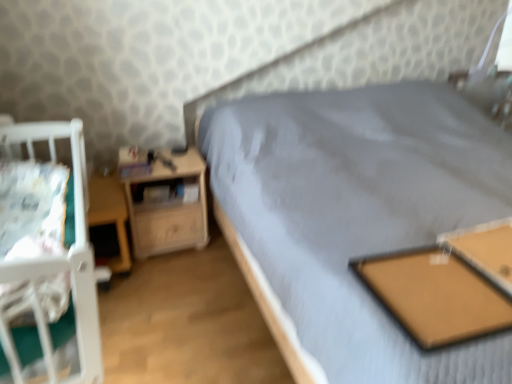
What is the approximate height of white fabric sheet at left?

white fabric sheet at left is 6.97 inches in height.

Identify the location of wooden table at lower left, which is counted as the second table, starting from the right. (110, 215).

From a real-world perspective, which object stands above the other?

brown cork board at center, which appears as the first table when viewed from the right, is physically above.

From the picture: Is brown cork board at center, which appears as the first table when viewed from the right, aimed at wooden table at lower left, which is counted as the first table, starting from the back?

No, brown cork board at center, which appears as the first table when viewed from the right, is not facing towards wooden table at lower left, which is counted as the first table, starting from the back.

Are brown cork board at center, marked as the second table in a back-to-front arrangement, and wooden table at lower left, which is counted as the second table, starting from the front, making contact?

No, brown cork board at center, marked as the second table in a back-to-front arrangement, is not in contact with wooden table at lower left, which is counted as the second table, starting from the front.

Is white fabric infant bed at left aimed at wooden nightstand at left?

No, white fabric infant bed at left is not aimed at wooden nightstand at left.

In terms of width, does white fabric infant bed at left look wider or thinner when compared to wooden nightstand at left?

Considering their sizes, white fabric infant bed at left looks slimmer than wooden nightstand at left.

From a real-world perspective, does white fabric infant bed at left sit lower than wooden nightstand at left?

No, from a real-world perspective, white fabric infant bed at left is not below wooden nightstand at left.

Consider the image. Is white fabric infant bed at left not inside wooden nightstand at left?

Yes, white fabric infant bed at left is not within wooden nightstand at left.

Could you tell me if white fabric sheet at left is facing brown cork board at center, the second table when ordered from left to right?

Yes, white fabric sheet at left is facing brown cork board at center, the second table when ordered from left to right.

Locate an element on the screen. The image size is (512, 384). table below the white fabric sheet at left (from the image's perspective) is located at coordinates (447, 284).

How many degrees apart are the facing directions of white fabric sheet at left and brown cork board at center, which appears as the first table when viewed from the right?

The angle between the facing direction of white fabric sheet at left and the facing direction of brown cork board at center, which appears as the first table when viewed from the right, is 88.5 degrees.

Are white fabric sheet at left and brown cork board at center, marked as the second table in a back-to-front arrangement, far apart?

That's not correct — white fabric sheet at left is a little close to brown cork board at center, marked as the second table in a back-to-front arrangement.

Is wooden nightstand at left spatially inside white fabric infant bed at left, or outside of it?

wooden nightstand at left is located beyond the bounds of white fabric infant bed at left.

Which of these two, wooden nightstand at left or white fabric infant bed at left, stands shorter?

white fabric infant bed at left.

In the image, is wooden nightstand at left positioned in front of or behind white fabric infant bed at left?

wooden nightstand at left is positioned farther from the viewer than white fabric infant bed at left.

Does wooden nightstand at left turn towards white fabric infant bed at left?

No, wooden nightstand at left is not oriented towards white fabric infant bed at left.

From a real-world perspective, which object rests below the other?

brown cork board at center, which appears as the first table when viewed from the right, is physically lower.

Is brown cork board at center, marked as the second table in a back-to-front arrangement, smaller than white fabric sheet at left?

No, brown cork board at center, marked as the second table in a back-to-front arrangement, is not smaller than white fabric sheet at left.

Is brown cork board at center, the first table viewed from the front, looking in the opposite direction of white fabric sheet at left?

No, brown cork board at center, the first table viewed from the front,'s orientation is not away from white fabric sheet at left.

From a real-world perspective, which object stands above the other?

white fabric sheet at left, from a real-world perspective.

Considering their positions, is white fabric sheet at left located in front of or behind wooden nightstand at left?

Visually, white fabric sheet at left is located in front of wooden nightstand at left.

Locate an element on the screen. sheet lying below the wooden nightstand at left (from the image's perspective) is located at coordinates click(32, 208).

Considering the relative positions of white fabric sheet at left and wooden nightstand at left in the image provided, is white fabric sheet at left to the right of wooden nightstand at left from the viewer's perspective?

Incorrect, white fabric sheet at left is not on the right side of wooden nightstand at left.

Looking at their sizes, would you say wooden table at lower left, which is counted as the second table, starting from the front, is wider or thinner than wooden nightstand at left?

wooden table at lower left, which is counted as the second table, starting from the front, is wider than wooden nightstand at left.

Is wooden nightstand at left located within wooden table at lower left, marked as the 1th table in a left-to-right arrangement?

No, wooden nightstand at left is not surrounded by wooden table at lower left, marked as the 1th table in a left-to-right arrangement.

Is wooden table at lower left, which is counted as the second table, starting from the front, behind wooden nightstand at left?

No, it is not.

Find the location of `table located on the left of brown cork board at center, the first table viewed from the front`. table located on the left of brown cork board at center, the first table viewed from the front is located at coordinates (110, 215).

Locate an element on the screen. This screenshot has height=384, width=512. nightstand that is under the white fabric infant bed at left (from a real-world perspective) is located at coordinates (168, 209).

Looking at this image, which object lies further to the anchor point brown cork board at center, the first table viewed from the front, wooden table at lower left, marked as the 1th table in a left-to-right arrangement, or white fabric sheet at left?

Among the two, wooden table at lower left, marked as the 1th table in a left-to-right arrangement, is located further to brown cork board at center, the first table viewed from the front.

From the image, which object appears to be nearer to white fabric sheet at left, brown cork board at center, the second table when ordered from left to right, or white fabric infant bed at left?

white fabric infant bed at left is positioned closer to the anchor white fabric sheet at left.

Looking at this image, estimate the real-world distances between objects in this image. Which object is closer to wooden nightstand at left, brown cork board at center, marked as the second table in a back-to-front arrangement, or white fabric sheet at left?

white fabric sheet at left is positioned closer to the anchor wooden nightstand at left.

Estimate the real-world distances between objects in this image. Which object is further from white fabric sheet at left, white fabric infant bed at left or brown cork board at center, the second table when ordered from left to right?

Among the two, brown cork board at center, the second table when ordered from left to right, is located further to white fabric sheet at left.

Looking at the image, which one is located closer to white fabric sheet at left, white fabric infant bed at left or wooden nightstand at left?

white fabric infant bed at left is closer to white fabric sheet at left.

Based on their spatial positions, is wooden nightstand at left or wooden table at lower left, marked as the 1th table in a left-to-right arrangement, further from white fabric infant bed at left?

The object further to white fabric infant bed at left is wooden nightstand at left.

Based on their spatial positions, is wooden nightstand at left or white fabric sheet at left further from wooden table at lower left, which is counted as the second table, starting from the front?

white fabric sheet at left is further to wooden table at lower left, which is counted as the second table, starting from the front.

Which object lies nearer to the anchor point wooden table at lower left, which is counted as the first table, starting from the back, white fabric infant bed at left or wooden nightstand at left?

Based on the image, wooden nightstand at left appears to be nearer to wooden table at lower left, which is counted as the first table, starting from the back.

The width and height of the screenshot is (512, 384). Find the location of `sheet positioned between white fabric infant bed at left and wooden nightstand at left from near to far`. sheet positioned between white fabric infant bed at left and wooden nightstand at left from near to far is located at coordinates [32, 208].

Locate an element on the screen. Image resolution: width=512 pixels, height=384 pixels. sheet between white fabric infant bed at left and brown cork board at center, marked as the second table in a back-to-front arrangement, from left to right is located at coordinates (32, 208).

The height and width of the screenshot is (384, 512). What are the coordinates of `sheet between wooden table at lower left, which is counted as the second table, starting from the front, and brown cork board at center, which appears as the first table when viewed from the right, in the horizontal direction` in the screenshot? It's located at (32, 208).

Where is `nightstand between wooden table at lower left, which is counted as the first table, starting from the back, and brown cork board at center, which appears as the first table when viewed from the right, in the horizontal direction`? The height and width of the screenshot is (384, 512). nightstand between wooden table at lower left, which is counted as the first table, starting from the back, and brown cork board at center, which appears as the first table when viewed from the right, in the horizontal direction is located at coordinates (168, 209).